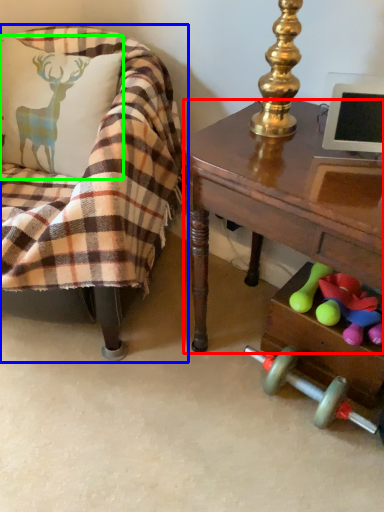
Question: Which object is positioned closest to desk (highlighted by a red box)? Select from chair (highlighted by a blue box) and pillow (highlighted by a green box).

Choices:
 (A) chair
 (B) pillow

Answer: (A)